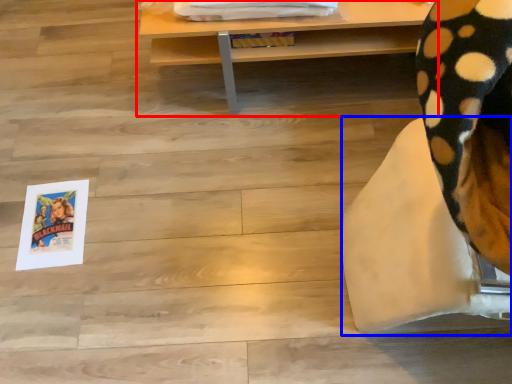
Question: Among these objects, which one is farthest to the camera, table (highlighted by a red box) or furniture (highlighted by a blue box)?

Choices:
 (A) table
 (B) furniture

Answer: (A)